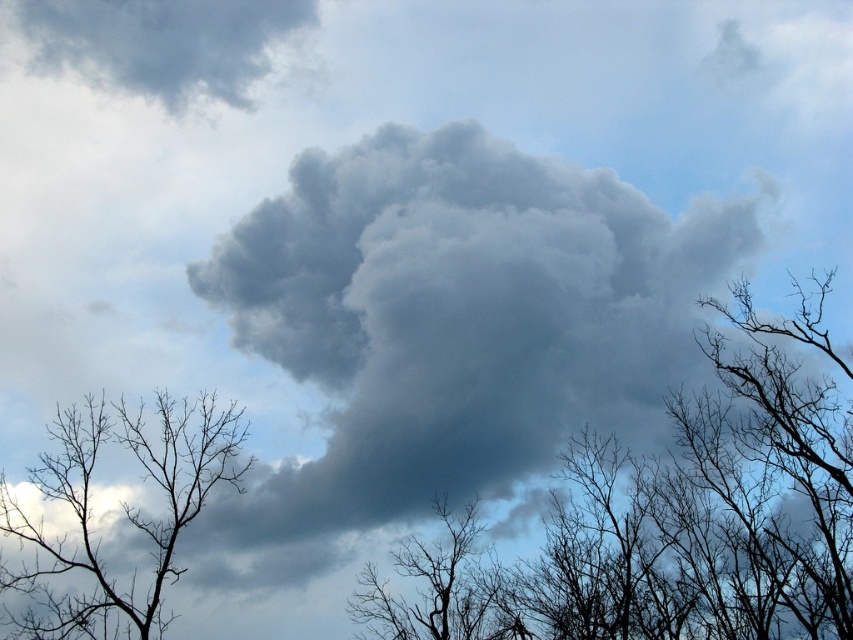
You are an artist trying to sketch this scene. You want to ensure the silhouette bare branches at left and the gray fluffy cloud at upper left are proportionally accurate. Which object should you draw first to maintain the correct size relationship between them?

You should draw the silhouette bare branches at left first since it is larger than the gray fluffy cloud at upper left, ensuring the size relationship is maintained.

You are standing in the scene and want to walk from the point at coordinates point [157,445] to the point at coordinates point [149,61]. Which direction should you face to move towards the second point?

To move from point [157,445] to point [149,61], you should face towards the left since point [149,61] is located to the left of point [157,445].